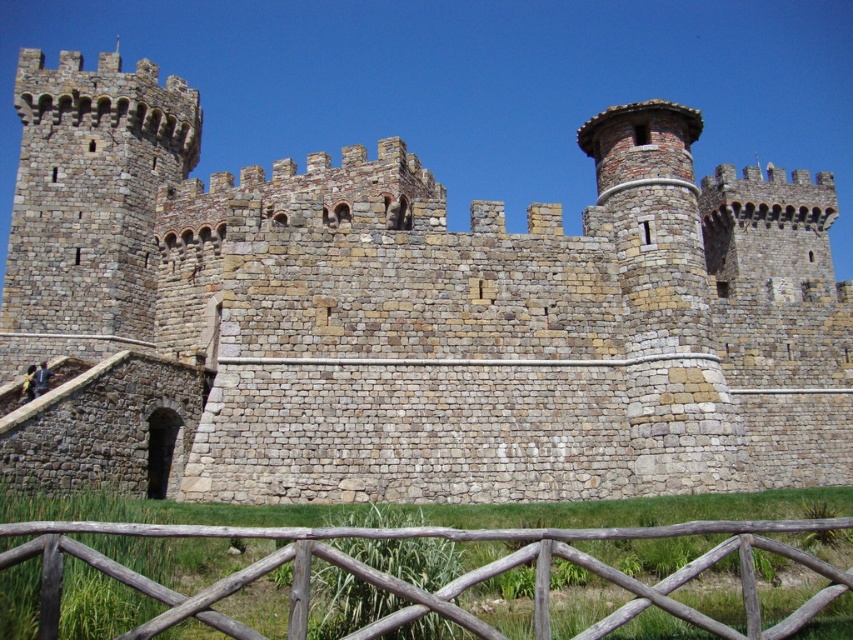
You are a knight standing at the wooden fence at lower center, looking towards the brown stone castle at center. Which structure appears bigger to you?

The brown stone castle at center appears bigger than the wooden fence at lower center because it has a larger size compared to the wooden fence at lower center.

You are a knight standing at the entrance of the brown stone castle at center. You notice a wooden fence at lower center. From your vantage point, which object is closer to you?

The brown stone castle at center is closer to you than the wooden fence at lower center because the wooden fence at lower center is positioned behind the castle.